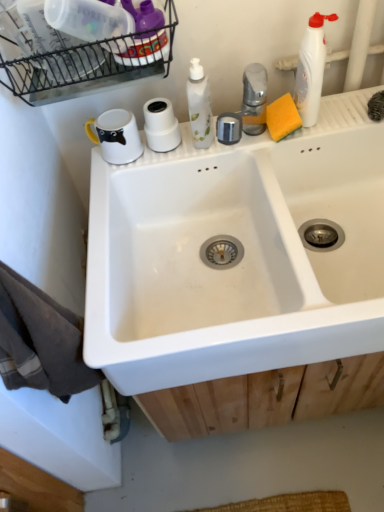
The height and width of the screenshot is (512, 384). Identify the location of vacant area that is situated to the right of white plastic bottle at upper right. (344, 109).